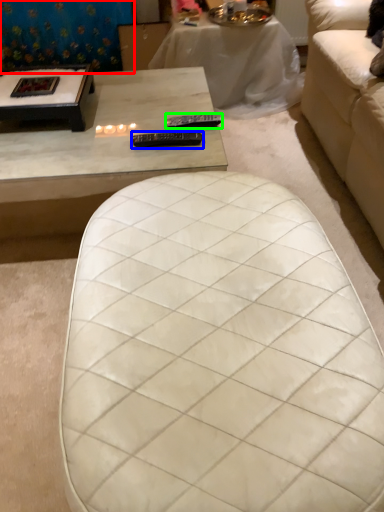
Question: Estimate the real-world distances between objects in this image. Which object is farther from curtain (highlighted by a red box), remote (highlighted by a blue box) or remote (highlighted by a green box)?

Choices:
 (A) remote
 (B) remote

Answer: (A)